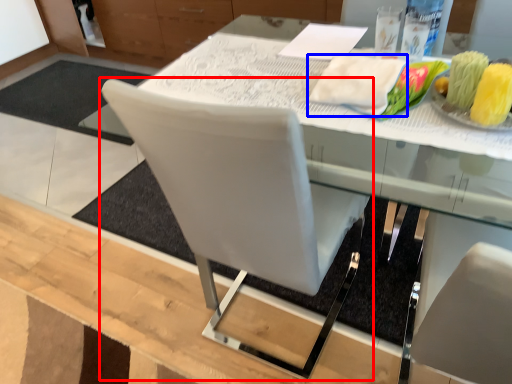
Question: Which of the following is the closest to the observer, chair (highlighted by a red box) or cloth (highlighted by a blue box)?

Choices:
 (A) chair
 (B) cloth

Answer: (A)